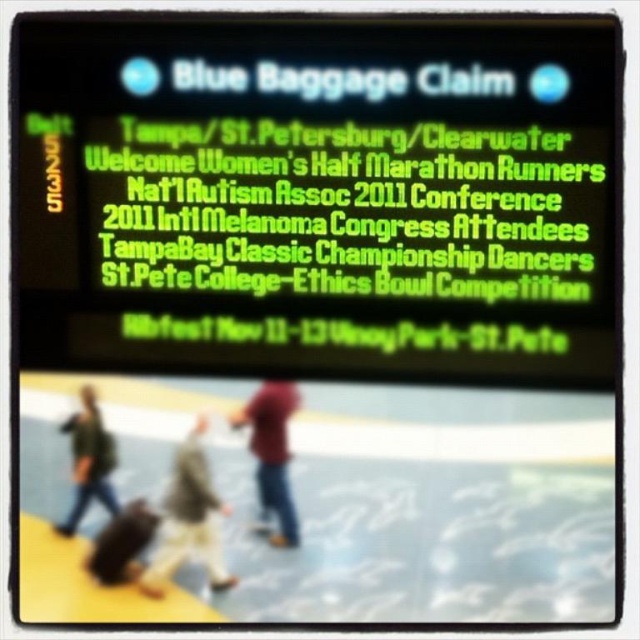
Is light beige fabric jacket at center smaller than red matte shirt at center?

No.

Who is more forward, (220, 554) or (259, 440)?

Point (220, 554) is more forward.

The height and width of the screenshot is (640, 640). I want to click on light beige fabric jacket at center, so click(188, 518).

Where is `light beige fabric jacket at center`? The height and width of the screenshot is (640, 640). light beige fabric jacket at center is located at coordinates (188, 518).

Does green neon sign at upper center have a larger size compared to red matte shirt at center?

Yes.

Is point (364, 168) positioned in front of point (276, 406)?

Yes, it is.

Between point (540, 305) and point (288, 490), which one is positioned behind?

Positioned behind is point (288, 490).

Identify the location of green neon sign at upper center. The image size is (640, 640). (348, 225).

Can you confirm if light beige fabric jacket at center is bigger than green fabric jacket at lower left?

Yes, light beige fabric jacket at center is bigger than green fabric jacket at lower left.

Who is shorter, light beige fabric jacket at center or green fabric jacket at lower left?

With less height is green fabric jacket at lower left.

Locate an element on the screen. The width and height of the screenshot is (640, 640). light beige fabric jacket at center is located at coordinates (188, 518).